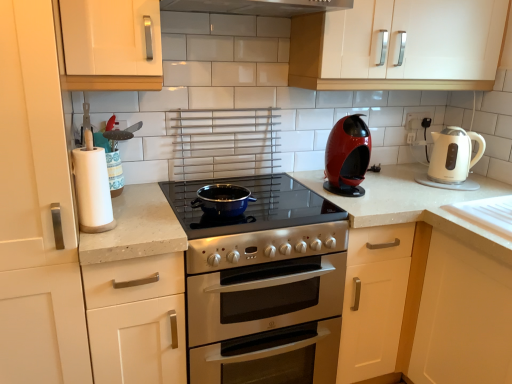
At what (x,y) coordinates should I click in order to perform the action: click on free location in front of red glossy coffee machine at center right, the 2th kitchen appliance from the right. Please return your answer as a coordinate pair (x, y). The image size is (512, 384). Looking at the image, I should click on (370, 201).